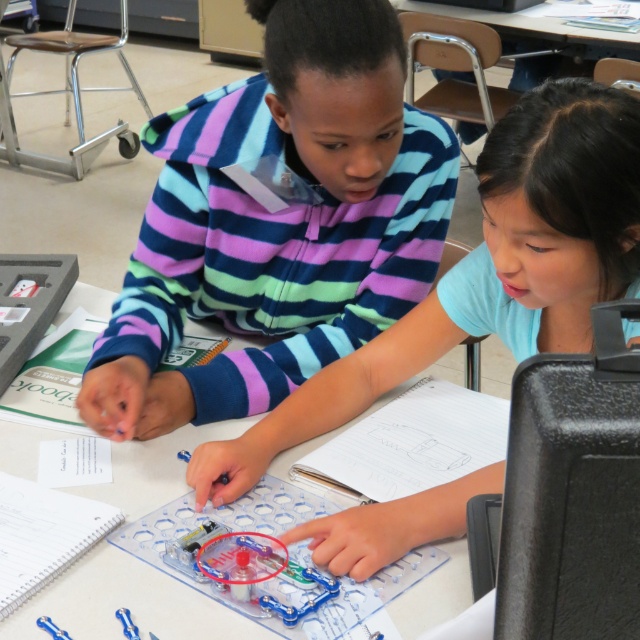
Question: Is matte plastic toy at center above clear plastic table at center?

Choices:
 (A) yes
 (B) no

Answer: (A)

Question: Which of the following is the closest to the observer?

Choices:
 (A) clear plastic table at center
 (B) matte plastic toy at center

Answer: (B)

Question: Is striped fleece at center wider than matte plastic toy at center?

Choices:
 (A) no
 (B) yes

Answer: (A)

Question: Which point appears farthest from the camera in this image?

Choices:
 (A) (408, 289)
 (B) (272, 422)
 (C) (218, 435)

Answer: (A)

Question: Where is striped fleece at center located in relation to clear plastic table at center in the image?

Choices:
 (A) above
 (B) below

Answer: (A)

Question: Which of the following is the closest to the observer?

Choices:
 (A) (580, 157)
 (B) (148, 618)
 (C) (202, 419)

Answer: (A)